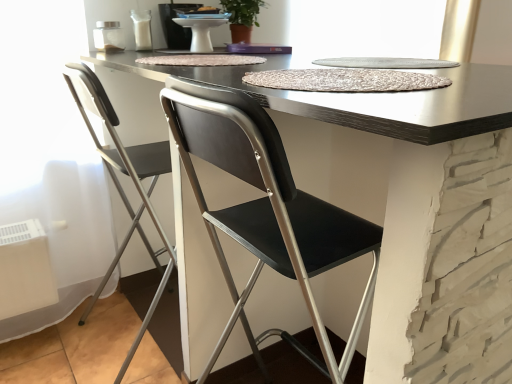
Question: Does matte black table at center have a larger size compared to metallic silver folding chair at left?

Choices:
 (A) no
 (B) yes

Answer: (B)

Question: Is matte black table at center facing towards metallic silver folding chair at left?

Choices:
 (A) yes
 (B) no

Answer: (B)

Question: From a real-world perspective, is matte black table at center on top of metallic silver folding chair at left?

Choices:
 (A) yes
 (B) no

Answer: (B)

Question: Are matte black table at center and metallic silver folding chair at left located far from each other?

Choices:
 (A) yes
 (B) no

Answer: (B)

Question: Is matte black table at center at the left side of metallic silver folding chair at left?

Choices:
 (A) no
 (B) yes

Answer: (A)

Question: Can you confirm if matte black table at center is shorter than metallic silver folding chair at left?

Choices:
 (A) yes
 (B) no

Answer: (A)

Question: Is matte black table at center positioned behind white glossy sink at upper center?

Choices:
 (A) yes
 (B) no

Answer: (B)

Question: Can you confirm if matte black table at center is bigger than white glossy sink at upper center?

Choices:
 (A) yes
 (B) no

Answer: (A)

Question: Would you say matte black table at center is a long distance from white glossy sink at upper center?

Choices:
 (A) yes
 (B) no

Answer: (A)

Question: Is white glossy sink at upper center at the back of matte black table at center?

Choices:
 (A) yes
 (B) no

Answer: (B)

Question: Is matte black table at center thinner than white glossy sink at upper center?

Choices:
 (A) no
 (B) yes

Answer: (A)

Question: From the image's perspective, is matte black table at center over white glossy sink at upper center?

Choices:
 (A) no
 (B) yes

Answer: (A)

Question: From a real-world perspective, is white glossy sink at upper center below matte black table at center?

Choices:
 (A) yes
 (B) no

Answer: (B)